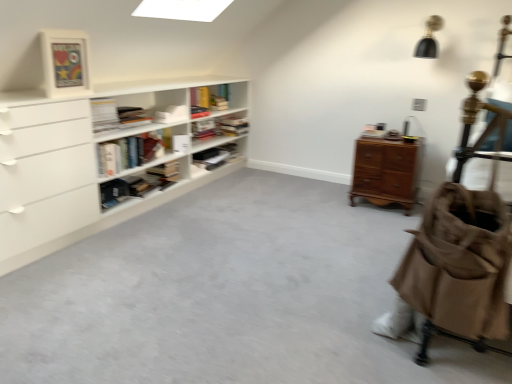
Where is `space that is in front of light brown wooden chest of drawers at right`? space that is in front of light brown wooden chest of drawers at right is located at coordinates (376, 218).